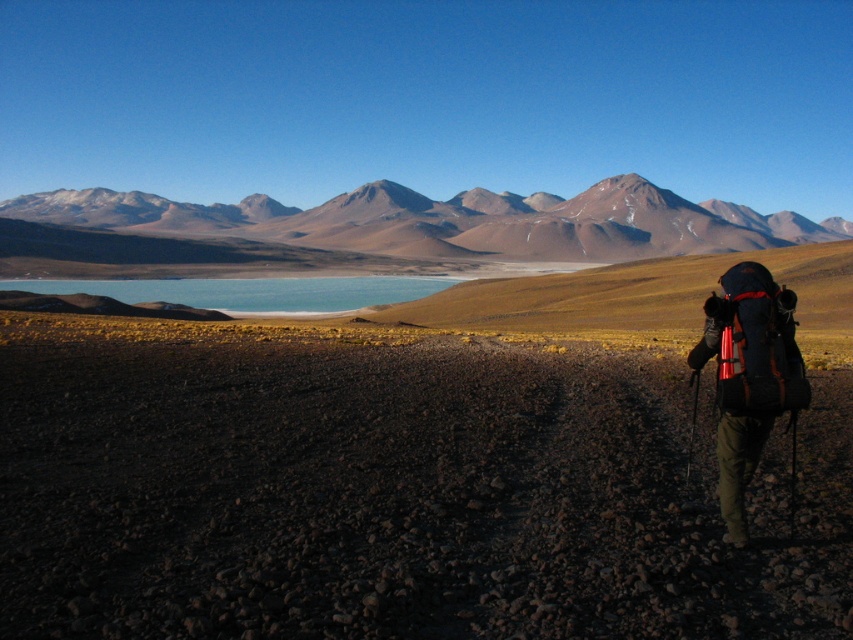
You are a hiker standing at the edge of the rocky terrain in the foreground of the image. You see the smooth brown mountains at upper center and the black nylon backpack at lower right. Which object is positioned to the left of the other?

The smooth brown mountains at upper center are to the left of the black nylon backpack at lower right.

You are standing at the origin point of the coordinate system in the image. You want to reach the smooth brown mountains at upper center. What are the coordinates you need to move towards?

The coordinates to move towards are 0.347 in the x direction and 0.525 in the y direction.

You are hiking in the desert and see the black nylon backpack at lower right and the matte black backpack at lower right. Which backpack is positioned more to the left side?

The black nylon backpack at lower right is positioned more to the left side than the matte black backpack at lower right.